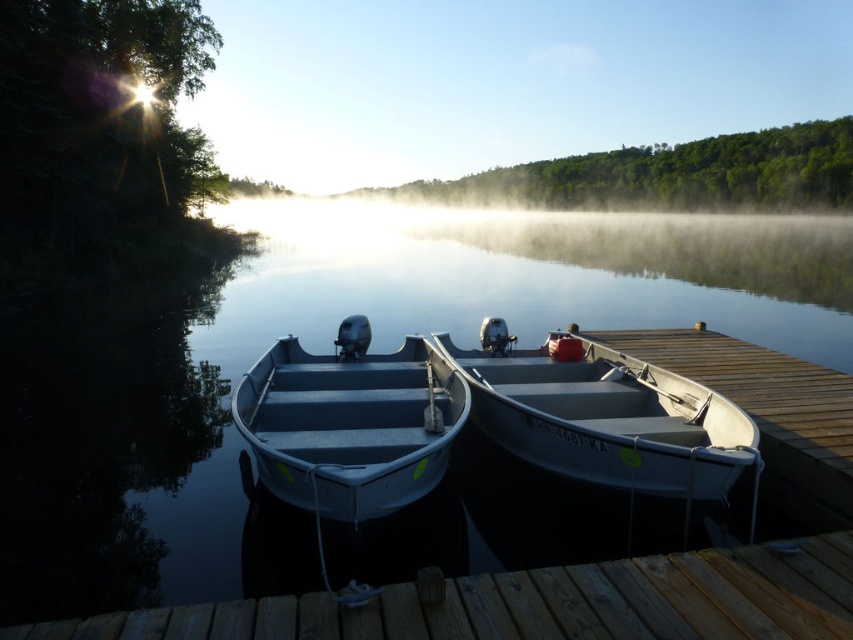
Question: Which of these objects is positioned closest to the metallic gray canoe at center?

Choices:
 (A) wooden dock at center
 (B) gray metallic canoe at center

Answer: (B)

Question: Where is clear water at center located in relation to metallic gray canoe at center in the image?

Choices:
 (A) below
 (B) above

Answer: (B)

Question: Among these objects, which one is farthest from the camera?

Choices:
 (A) clear water at center
 (B) wooden dock at center
 (C) gray metallic canoe at center
 (D) metallic gray canoe at center

Answer: (A)

Question: Does wooden dock at center appear on the left side of gray metallic canoe at center?

Choices:
 (A) no
 (B) yes

Answer: (B)

Question: Which is farther from the wooden dock at center?

Choices:
 (A) clear water at center
 (B) metallic gray canoe at center

Answer: (A)

Question: From the image, what is the correct spatial relationship of wooden dock at center in relation to metallic gray canoe at center?

Choices:
 (A) left
 (B) right

Answer: (B)